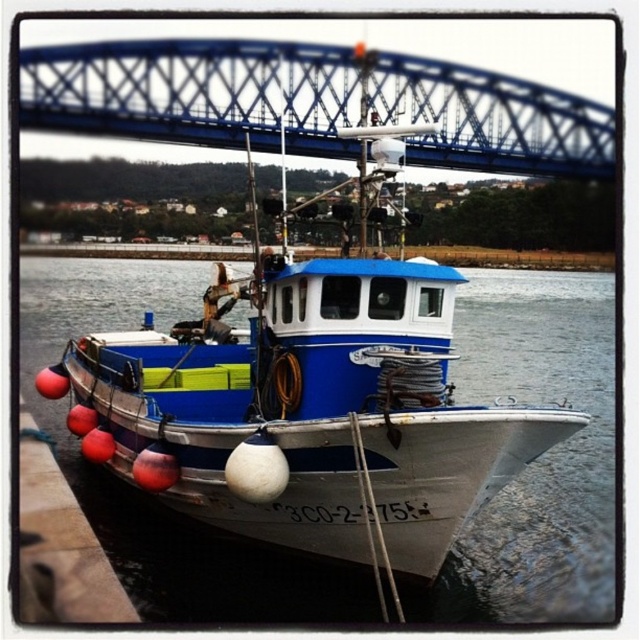
Describe the element at coordinates (196, 92) in the screenshot. The width and height of the screenshot is (640, 640). I see `blue metallic bridge at upper center` at that location.

Which of these two, blue metallic bridge at upper center or smooth concrete dock at lower left, stands shorter?

With less height is smooth concrete dock at lower left.

Measure the distance between point (454,92) and camera.

Point (454,92) is 485.90 feet away from camera.

This screenshot has width=640, height=640. I want to click on blue metallic bridge at upper center, so click(196, 92).

Can you confirm if white matte boat at center is positioned to the left of smooth concrete dock at lower left?

Incorrect, white matte boat at center is not on the left side of smooth concrete dock at lower left.

Which is above, white matte boat at center or smooth concrete dock at lower left?

Positioned higher is white matte boat at center.

Which is behind, point (257, 212) or point (52, 528)?

Point (257, 212)

At what (x,y) coordinates should I click in order to perform the action: click on white matte boat at center. Please return your answer as a coordinate pair (x, y). The height and width of the screenshot is (640, 640). Looking at the image, I should click on (308, 301).

Which of these two, white matte boat at center or blue metallic bridge at upper center, stands shorter?

Standing shorter between the two is blue metallic bridge at upper center.

Who is more forward, (228,513) or (525,161)?

Positioned in front is point (228,513).

Find the location of a particular element. The image size is (640, 640). white matte boat at center is located at coordinates (308, 301).